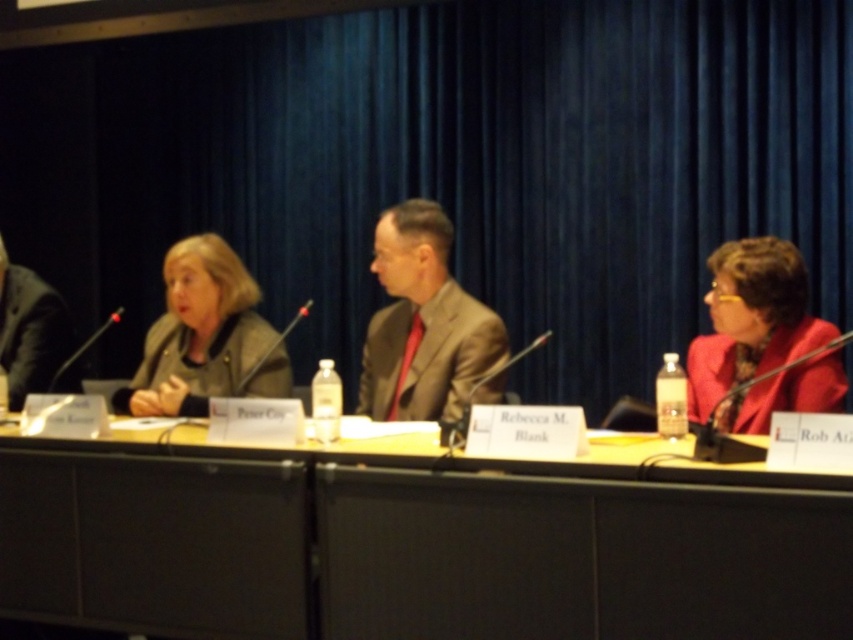
Question: Does yellow wood table at center appear over matte brown suit at center?

Choices:
 (A) no
 (B) yes

Answer: (A)

Question: Can you confirm if matte brown suit at center is wider than matte red blazer at right?

Choices:
 (A) yes
 (B) no

Answer: (A)

Question: Is matte red blazer at right to the right of matte brown jacket at center from the viewer's perspective?

Choices:
 (A) no
 (B) yes

Answer: (B)

Question: Which object is farther from the camera taking this photo?

Choices:
 (A) yellow wood table at center
 (B) black suit at left
 (C) matte brown jacket at center

Answer: (B)

Question: Estimate the real-world distances between objects in this image. Which object is farther from the black suit at left?

Choices:
 (A) matte red blazer at right
 (B) matte brown suit at center
 (C) yellow wood table at center
 (D) matte brown jacket at center

Answer: (A)

Question: Which object appears farthest from the camera in this image?

Choices:
 (A) yellow wood table at center
 (B) black suit at left
 (C) matte red blazer at right

Answer: (B)